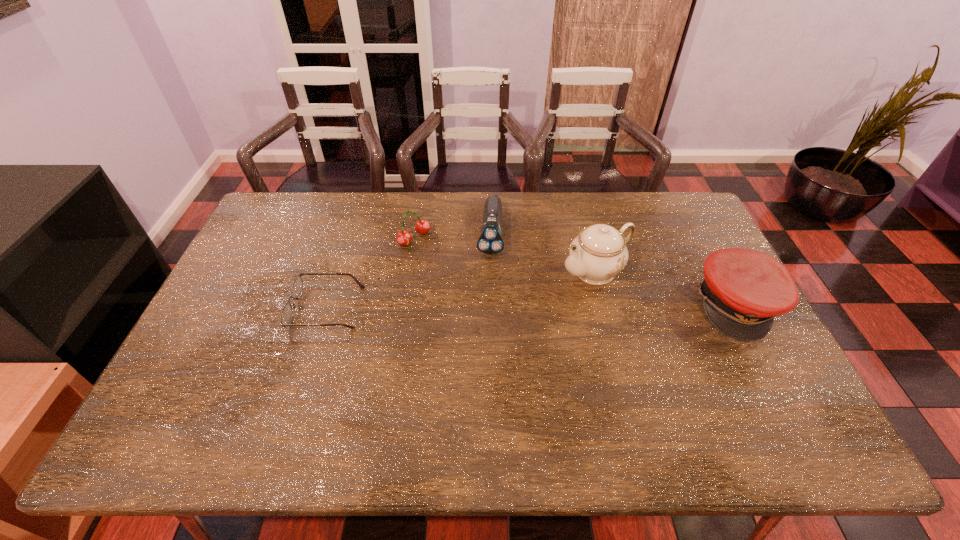
At what (x,y) coordinates should I click in order to perform the action: click on the shortest object. Please return your answer as a coordinate pair (x, y). Looking at the image, I should click on (286, 313).

The image size is (960, 540). I want to click on the leftmost object, so click(x=286, y=313).

At what (x,y) coordinates should I click in order to perform the action: click on cap. Please return your answer as a coordinate pair (x, y). The width and height of the screenshot is (960, 540). Looking at the image, I should click on (743, 290).

The image size is (960, 540). Find the location of `the second object from left to right`. the second object from left to right is located at coordinates (422, 226).

In order to click on the third object from left to right in this screenshot , I will do `click(490, 242)`.

You are a GUI agent. You are given a task and a screenshot of the screen. Output one action in this format:
    pyautogui.click(x=<x>, y=<y>)
    Task: Click on the electric shaver
    Image resolution: width=960 pixels, height=540 pixels.
    Given the screenshot: What is the action you would take?
    pyautogui.click(x=490, y=242)

You are a GUI agent. You are given a task and a screenshot of the screen. Output one action in this format:
    pyautogui.click(x=<x>, y=<y>)
    Task: Click on the fourth object from left to right
    
    Given the screenshot: What is the action you would take?
    pyautogui.click(x=599, y=252)

Locate an element on the screen. This screenshot has width=960, height=540. the tallest object is located at coordinates (599, 252).

Where is `blank space located on the front-facing side of the leftmost object`? The width and height of the screenshot is (960, 540). blank space located on the front-facing side of the leftmost object is located at coordinates (237, 308).

Identify the location of vacant space situated on the front-facing side of the leftmost object. The width and height of the screenshot is (960, 540). (224, 308).